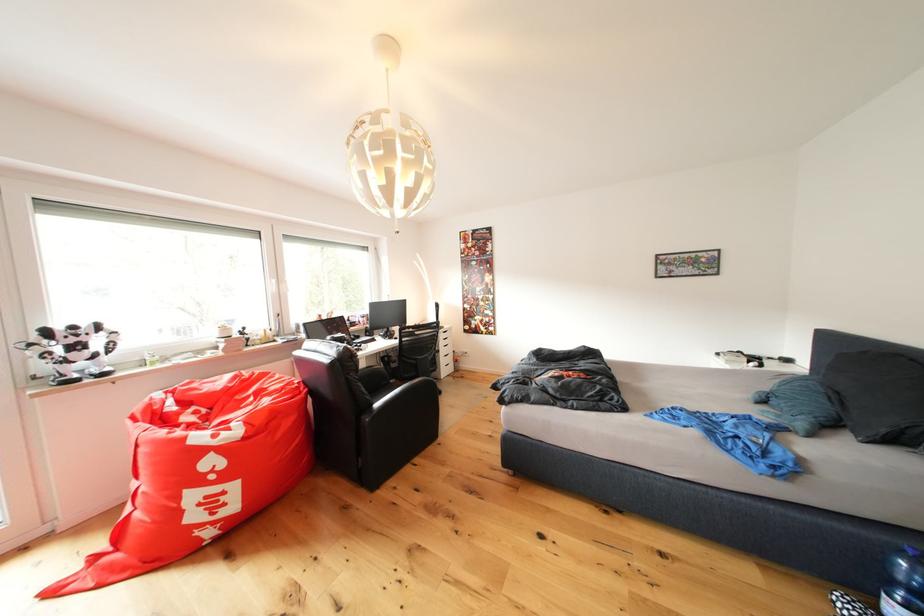
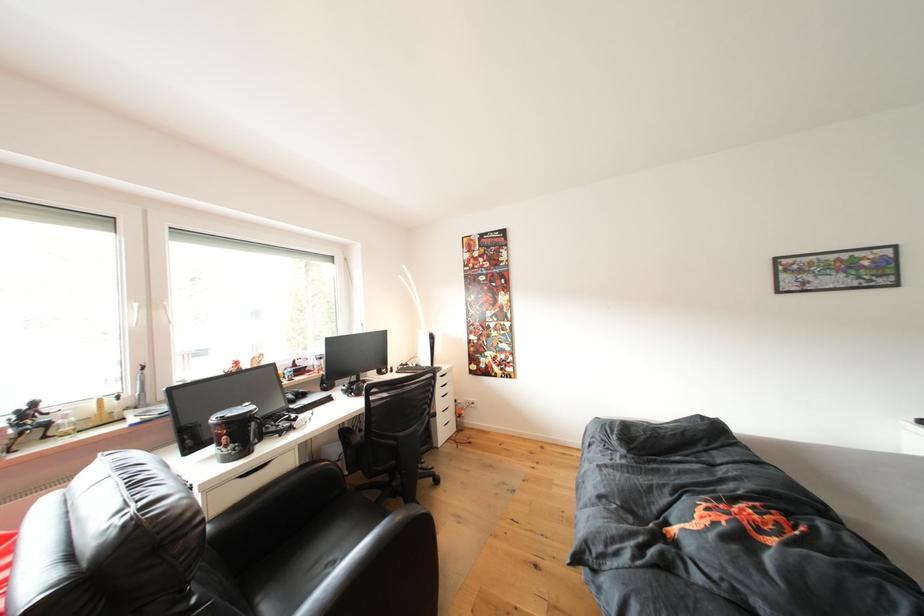
In the second image, find the point that corresponds to (451,334) in the first image.

(447, 381)